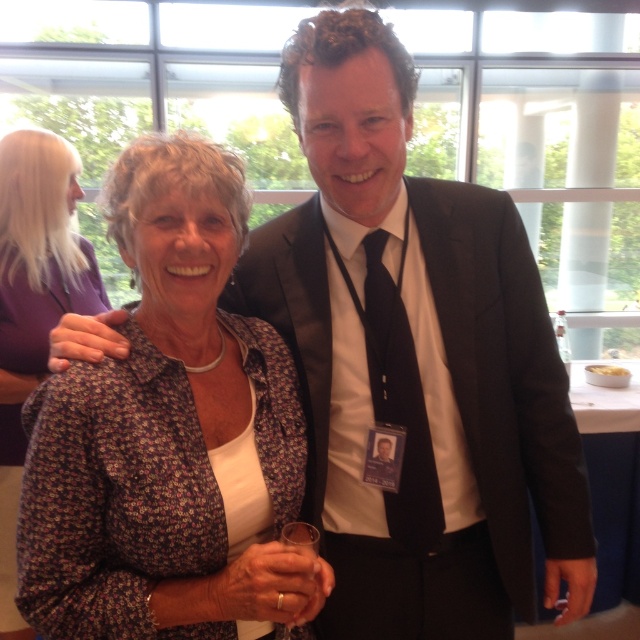
Question: Which point is farther to the camera?

Choices:
 (A) (516, 445)
 (B) (4, 243)

Answer: (B)

Question: Among these points, which one is farthest from the camera?

Choices:
 (A) (513, 433)
 (B) (26, 161)
 (C) (115, 209)
 (D) (412, 454)

Answer: (B)

Question: Does floral fabric blouse at center have a lesser width compared to black silk tie at center?

Choices:
 (A) no
 (B) yes

Answer: (A)

Question: Which point is closer to the camera?

Choices:
 (A) (20, 138)
 (B) (499, 250)
 (C) (300, 634)

Answer: (C)

Question: Is black smooth suit at center wider than floral fabric blouse at center?

Choices:
 (A) yes
 (B) no

Answer: (A)

Question: Is floral fabric blouse at center below black silk tie at center?

Choices:
 (A) no
 (B) yes

Answer: (A)